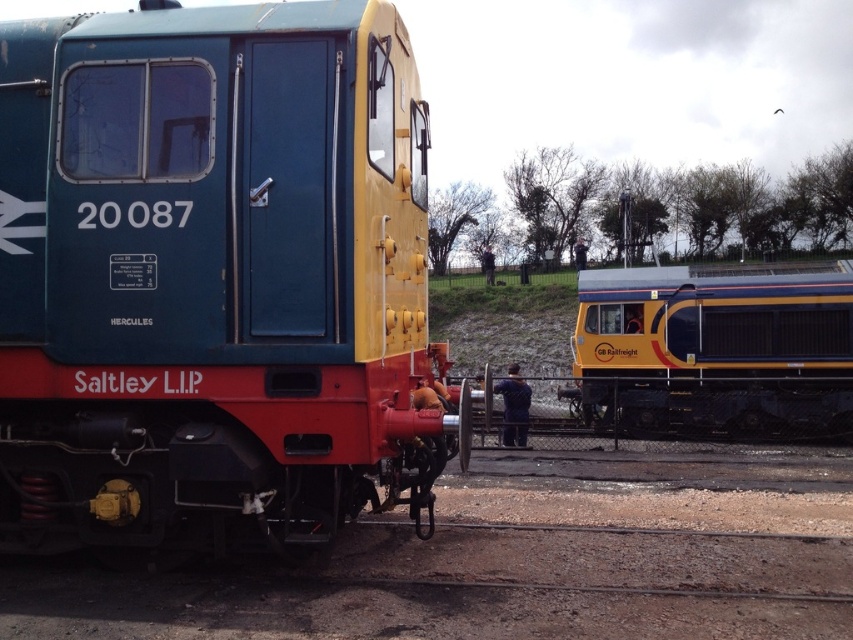
Does dirt track at lower center appear on the right side of yellow metallic train at right?

Incorrect, dirt track at lower center is not on the right side of yellow metallic train at right.

Between point (729, 616) and point (811, 381), which one is positioned in front?

Point (729, 616) is in front.

Does point (132, 589) come closer to viewer compared to point (717, 332)?

Yes, it is.

At what (x,y) coordinates should I click in order to perform the action: click on dirt track at lower center. Please return your answer as a coordinate pair (x, y). Looking at the image, I should click on (515, 561).

Is matte blue train at center to the right of dirt track at lower center from the viewer's perspective?

No, matte blue train at center is not to the right of dirt track at lower center.

Can you confirm if matte blue train at center is positioned above dirt track at lower center?

Indeed, matte blue train at center is positioned over dirt track at lower center.

Measure the distance between point [216,349] and camera.

Point [216,349] and camera are 4.80 meters apart.

Where is `matte blue train at center`? matte blue train at center is located at coordinates (215, 278).

Does matte blue train at center have a greater height compared to yellow metallic train at right?

Correct, matte blue train at center is much taller as yellow metallic train at right.

Can you confirm if matte blue train at center is shorter than yellow metallic train at right?

No, matte blue train at center is not shorter than yellow metallic train at right.

Locate an element on the screen. matte blue train at center is located at coordinates (215, 278).

Where is `matte blue train at center`? This screenshot has height=640, width=853. matte blue train at center is located at coordinates pyautogui.click(x=215, y=278).